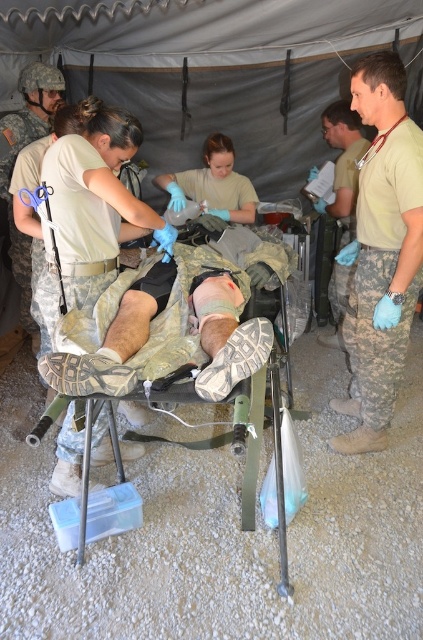
You are a medic in the field and need to quickly identify which uniform is nearer to you. Looking at the camouflage uniform at right and the tan uniform at right, which one is closer to your position?

The camouflage uniform at right is closer to the viewer than the tan uniform at right.

You are a medic in the field and need to quickly identify which piece of equipment is larger. Looking at the scene, which is bigger between the tan uniform at right and the matte blue gloves at center?

The matte blue gloves at center are larger than the tan uniform at right according to the description.

In the scene shown: You are a medic in the field and need to locate a specific point on the patient for treatment. The coordinates given are point (381, 252). Based on the scene description, where on the patient would this point be located?

The point (381, 252) is located on the camouflage uniform at the right side of the patient.